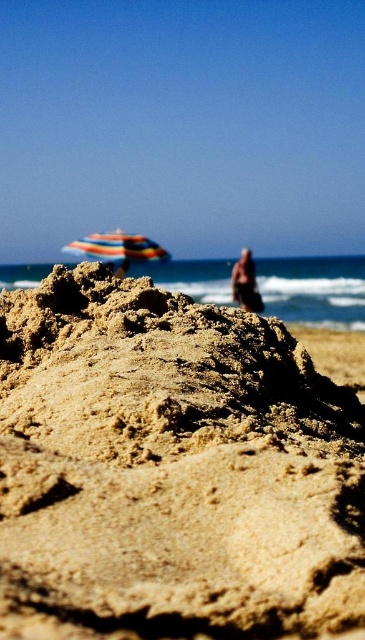
What are the coordinates of `fine-grained sand mound at center` in the screenshot? It's located at (171, 470).

Where is `smooth tan skin at upper right`? Image resolution: width=365 pixels, height=640 pixels. smooth tan skin at upper right is located at coordinates (244, 282).

Does striped fabric umbrella at upper center appear on the right side of smooth tan skin at upper right?

No, striped fabric umbrella at upper center is not to the right of smooth tan skin at upper right.

Can you confirm if striped fabric umbrella at upper center is thinner than smooth tan skin at upper right?

No, striped fabric umbrella at upper center is not thinner than smooth tan skin at upper right.

Is point (86, 252) positioned behind point (240, 304)?

That is True.

Locate an element on the screen. striped fabric umbrella at upper center is located at coordinates (117, 248).